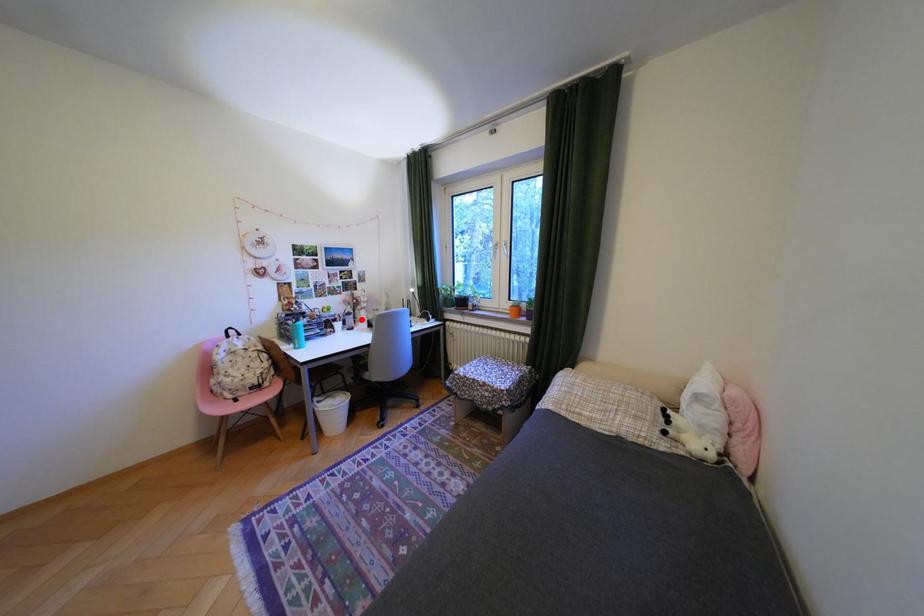
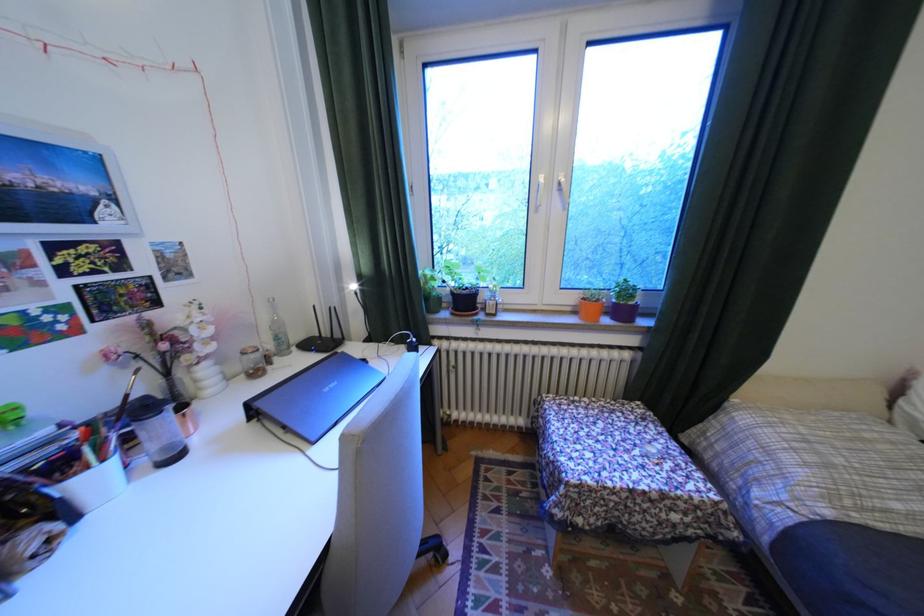
In the second image, find the point that corresponds to the highlighted location in the first image.

(172, 424)